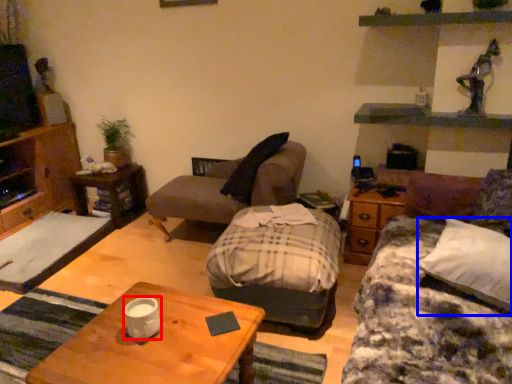
Question: Among these objects, which one is nearest to the camera, coffee cup (highlighted by a red box) or pillow (highlighted by a blue box)?

Choices:
 (A) coffee cup
 (B) pillow

Answer: (B)